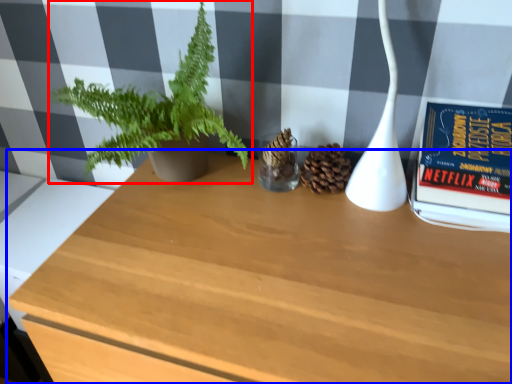
Question: Which of the following is the closest to the observer, houseplant (highlighted by a red box) or table (highlighted by a blue box)?

Choices:
 (A) houseplant
 (B) table

Answer: (B)